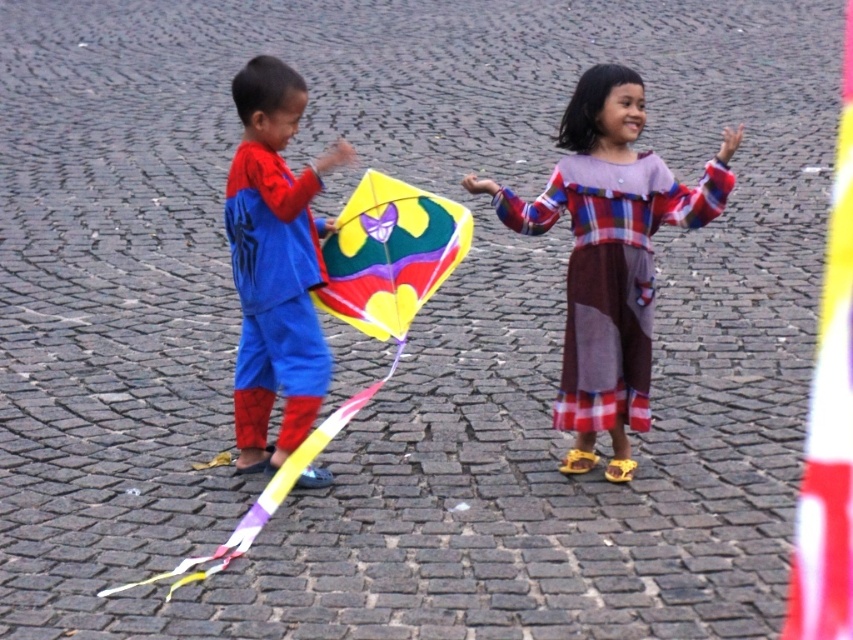
Is plaid cotton dress at center to the left of multicolored paper kite at center from the viewer's perspective?

In fact, plaid cotton dress at center is to the right of multicolored paper kite at center.

Who is taller, plaid cotton dress at center or multicolored paper kite at center?

plaid cotton dress at center is taller.

Is point (593, 115) closer to camera compared to point (345, 241)?

Yes, point (593, 115) is in front of point (345, 241).

Find the location of a particular element. The height and width of the screenshot is (640, 853). plaid cotton dress at center is located at coordinates (608, 253).

Who is more distant from viewer, (612, 317) or (270, 131)?

Point (612, 317)

From the picture: Between plaid cotton dress at center and matte blue pants at left, which one has more height?

plaid cotton dress at center

Identify the location of plaid cotton dress at center. (608, 253).

Is matte blue pants at left closer to the viewer compared to multicolored paper kite at center?

Yes.

Is matte blue pants at left above multicolored paper kite at center?

Incorrect, matte blue pants at left is not positioned above multicolored paper kite at center.

Based on the photo, who is more distant from viewer, [285,177] or [358,403]?

Point [285,177]

Locate an element on the screen. The image size is (853, 640). matte blue pants at left is located at coordinates (276, 264).